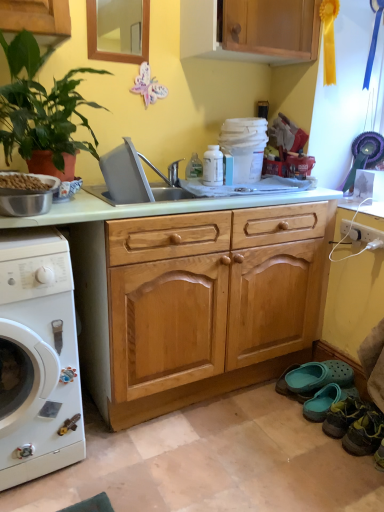
Image resolution: width=384 pixels, height=512 pixels. What are the coordinates of `free spot above teal rubber clog at lower right, the 1th shoe positioned from the back (from a real-world perspective)` in the screenshot? It's located at (309, 375).